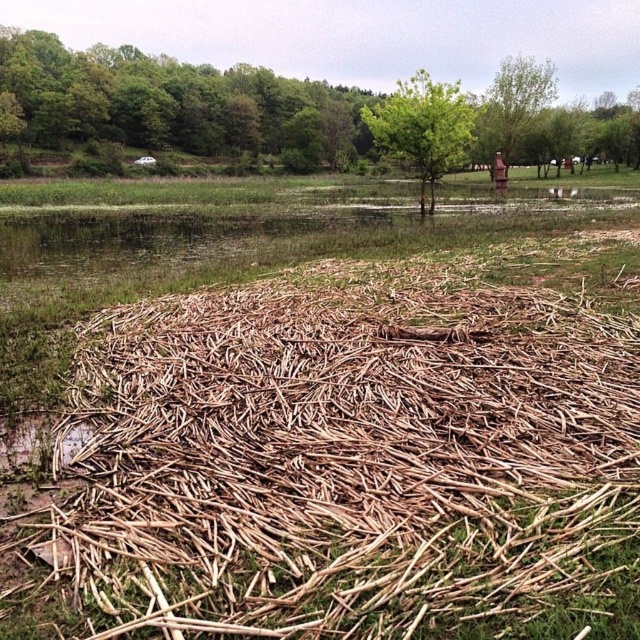
Question: Can you confirm if green leafy tree at center is positioned to the left of green matte tree at upper center?

Choices:
 (A) no
 (B) yes

Answer: (B)

Question: Is brown wood reed at center thinner than green leafy tree at center?

Choices:
 (A) yes
 (B) no

Answer: (A)

Question: Which point appears closest to the camera in this image?

Choices:
 (A) (193, 88)
 (B) (497, 88)
 (C) (67, 566)

Answer: (C)

Question: Is green leafy tree at center to the right of green matte tree at upper center from the viewer's perspective?

Choices:
 (A) yes
 (B) no

Answer: (B)

Question: Among these points, which one is nearest to the camera?

Choices:
 (A) (88, 493)
 (B) (173, 113)

Answer: (A)

Question: Which of the following is the closest to the observer?

Choices:
 (A) (477, 122)
 (B) (413, 122)
 (C) (342, 582)
 (D) (83, 54)

Answer: (C)